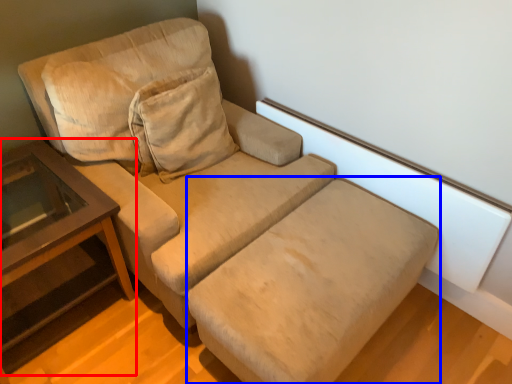
Question: Among these objects, which one is farthest to the camera, table (highlighted by a red box) or footrest (highlighted by a blue box)?

Choices:
 (A) table
 (B) footrest

Answer: (A)